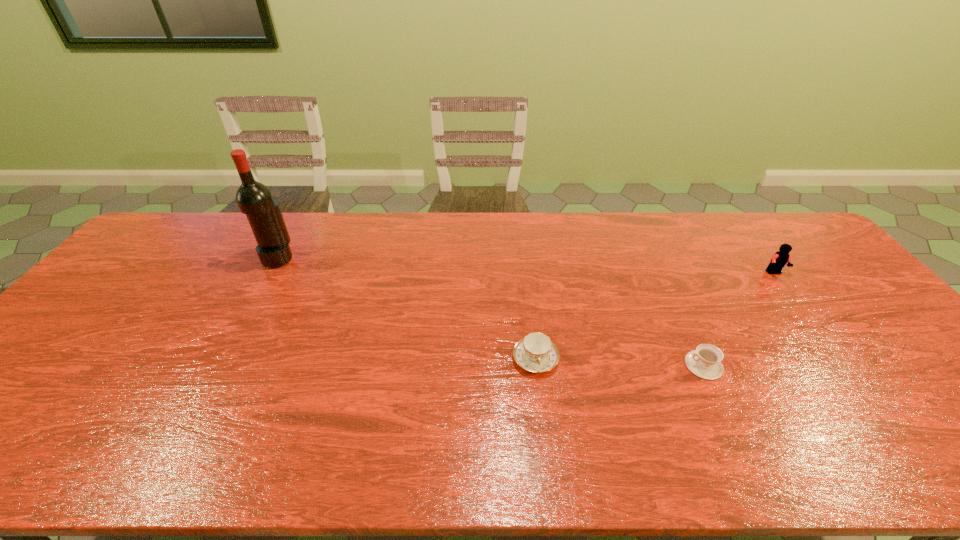
The width and height of the screenshot is (960, 540). Find the location of `the tallest object`. the tallest object is located at coordinates (254, 199).

Image resolution: width=960 pixels, height=540 pixels. Identify the location of the leftmost object. (254, 199).

Locate an element on the screen. Lego is located at coordinates (781, 257).

The height and width of the screenshot is (540, 960). Identify the location of the rightmost object. (781, 257).

The width and height of the screenshot is (960, 540). I want to click on the second object from left to right, so click(536, 353).

Find the location of a particular element. The image size is (960, 540). the taller teacup is located at coordinates (536, 353).

This screenshot has width=960, height=540. Identify the location of the right teacup. coord(704,362).

The image size is (960, 540). I want to click on the shorter teacup, so click(x=704, y=362).

You are a GUI agent. You are given a task and a screenshot of the screen. Output one action in this format:
    pyautogui.click(x=<x>, y=<y>)
    Task: Click on the vacant position located on the front of the leftmost object
    The image size is (960, 540).
    Given the screenshot: What is the action you would take?
    pyautogui.click(x=217, y=369)

Find the location of a particular element. This screenshot has width=960, height=540. free spot located 0.330m on the front-facing side of the Lego is located at coordinates (846, 365).